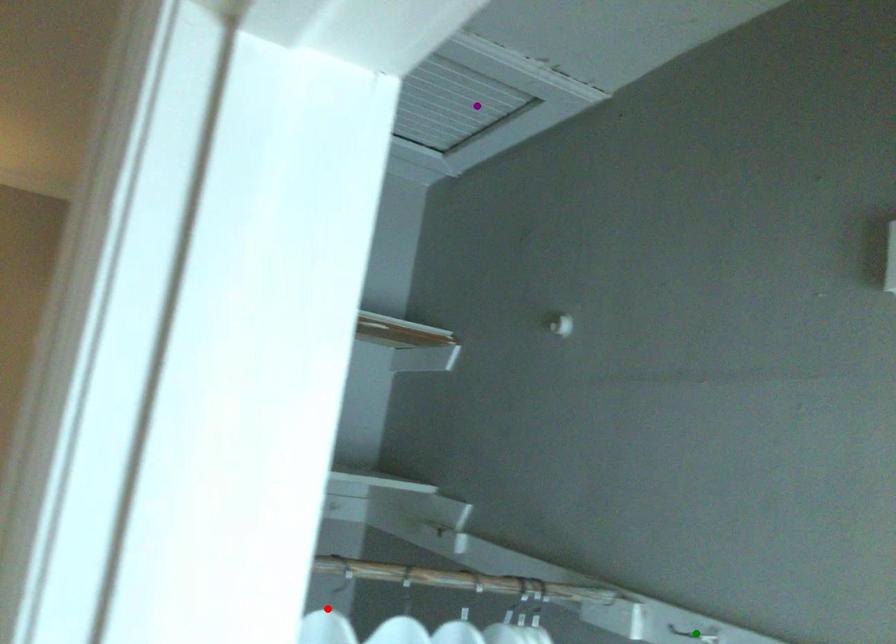
Order these from nearest to farthest:
purple point | red point | green point

red point
green point
purple point